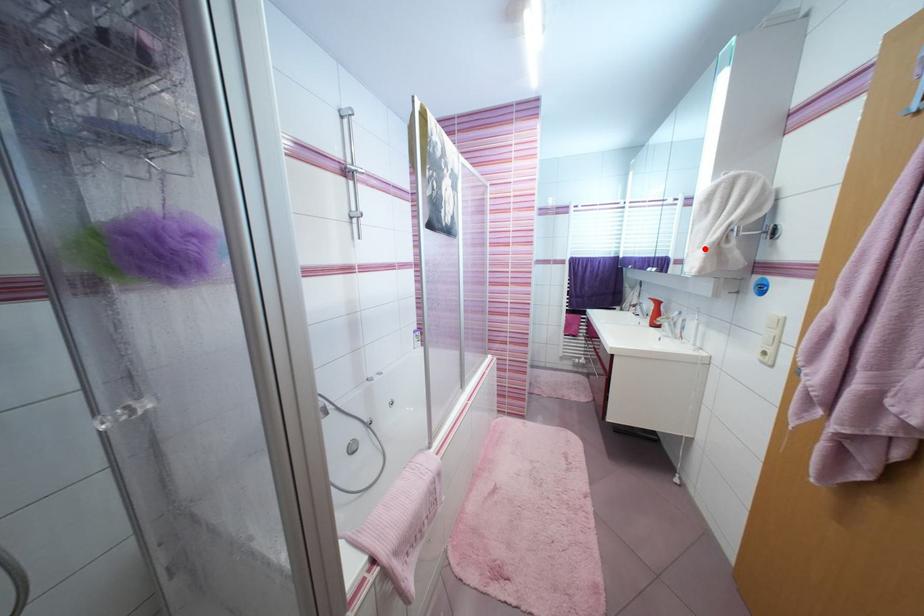
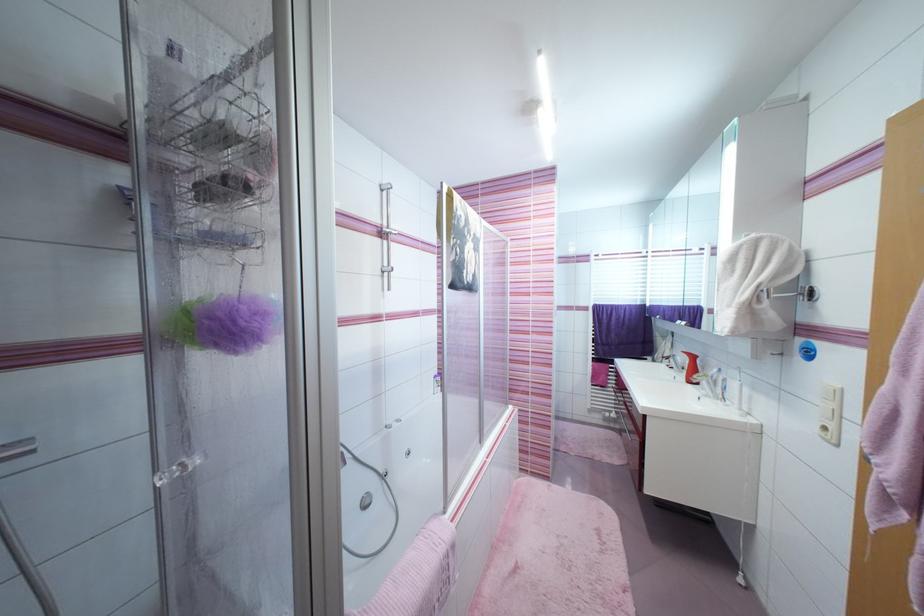
Locate, in the second image, the point that corresponds to the highlighted location in the first image.

(735, 307)